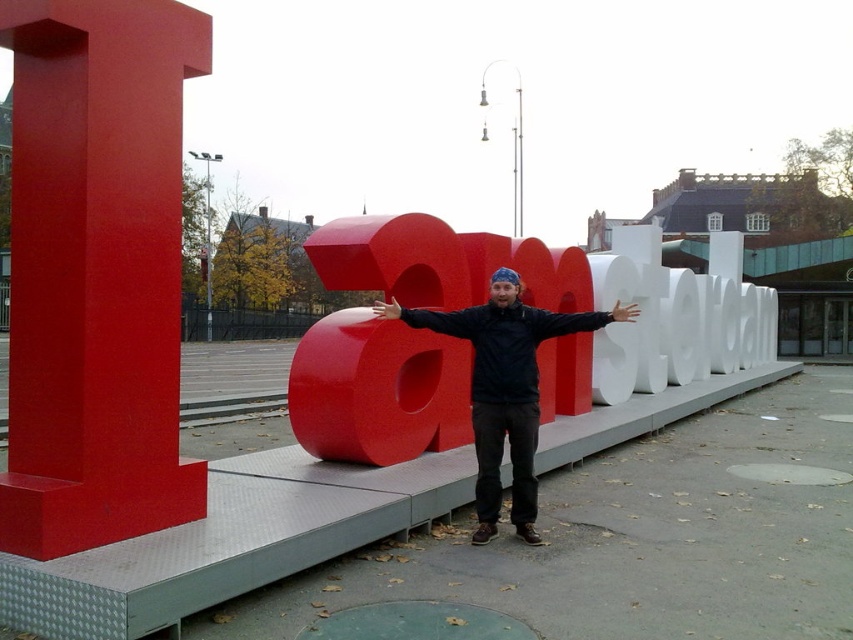
Does smooth skin hand at center have a smaller size compared to matte red hand at center?

No, smooth skin hand at center is not smaller than matte red hand at center.

Does smooth skin hand at center appear under matte red hand at center?

No, smooth skin hand at center is not below matte red hand at center.

Is point (639, 310) positioned in front of point (376, 307)?

That is False.

Where is `smooth skin hand at center`? This screenshot has height=640, width=853. smooth skin hand at center is located at coordinates (624, 310).

This screenshot has width=853, height=640. What do you see at coordinates (503, 390) in the screenshot? I see `dark blue jacket at center` at bounding box center [503, 390].

Can you confirm if dark blue jacket at center is positioned to the left of matte black arm at center?

In fact, dark blue jacket at center is to the right of matte black arm at center.

At what (x,y) coordinates should I click in order to perform the action: click on dark blue jacket at center. Please return your answer as a coordinate pair (x, y). This screenshot has width=853, height=640. Looking at the image, I should click on (503, 390).

Between point (408, 310) and point (379, 308), which one is positioned behind?

The point (408, 310) is behind.

Which is above, matte black arm at center or matte red hand at center?

matte red hand at center

Is point (440, 316) positioned behind point (398, 317)?

That is True.

Locate an element on the screen. The image size is (853, 640). matte black arm at center is located at coordinates (433, 317).